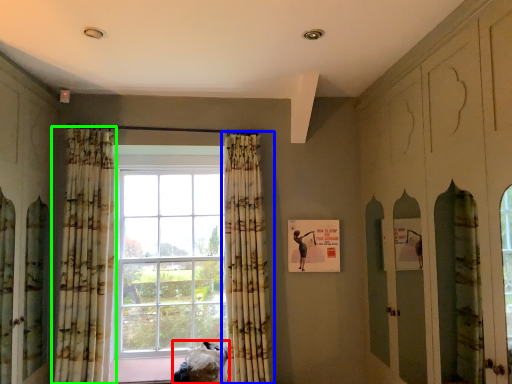
Question: Which is nearer to the furniture (highlighted by a red box)? curtain (highlighted by a blue box) or curtain (highlighted by a green box).

Choices:
 (A) curtain
 (B) curtain

Answer: (A)